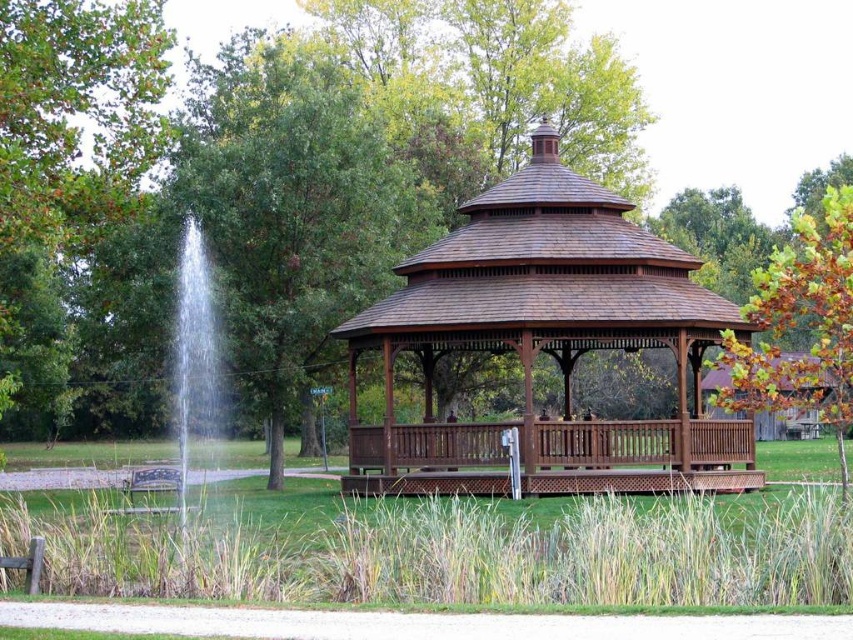
Question: Does brown wooden gazebo at center appear on the left side of green leafy tree at center?

Choices:
 (A) yes
 (B) no

Answer: (B)

Question: Which object is positioned closest to the green leafy tree at center?

Choices:
 (A) wooden bench at lower left
 (B) brown wooden gazebo at center

Answer: (B)

Question: Does green leafy tree at center appear over wooden bench at lower left?

Choices:
 (A) yes
 (B) no

Answer: (A)

Question: Where is brown wooden gazebo at center located in relation to green leafy tree at center in the image?

Choices:
 (A) below
 (B) above

Answer: (A)

Question: Which object appears closest to the camera in this image?

Choices:
 (A) green leafy tree at center
 (B) wooden bench at lower left

Answer: (B)

Question: Which object is the closest to the brown wooden gazebo at center?

Choices:
 (A) green leafy tree at center
 (B) wooden bench at lower left

Answer: (B)